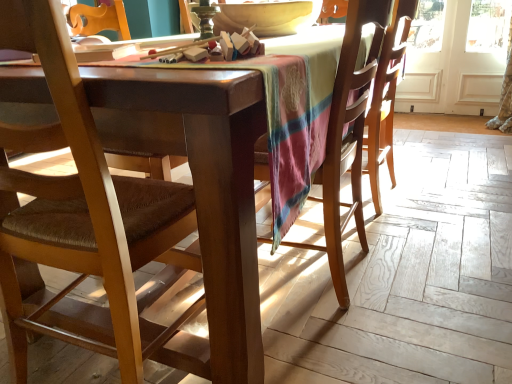
Question: Is white wood screen door at upper right wider or thinner than wooden chair at center, which ranks as the 2th chair in left-to-right order?

Choices:
 (A) thin
 (B) wide

Answer: (A)

Question: From their relative heights in the image, would you say white wood screen door at upper right is taller or shorter than wooden chair at center, which ranks as the 2th chair in left-to-right order?

Choices:
 (A) short
 (B) tall

Answer: (B)

Question: Which is farther from the wooden chair at center, which ranks as the 2th chair in left-to-right order?

Choices:
 (A) matte yellow bowl at upper center
 (B) white wood screen door at upper right
 (C) brown fabric chair at left, which ranks as the second chair in right-to-left order

Answer: (B)

Question: Which of these objects is positioned farthest from the brown fabric chair at left, the first chair in the left-to-right sequence?

Choices:
 (A) white wood screen door at upper right
 (B) matte yellow bowl at upper center
 (C) wooden chair at center, marked as the 1th chair in a right-to-left arrangement

Answer: (A)